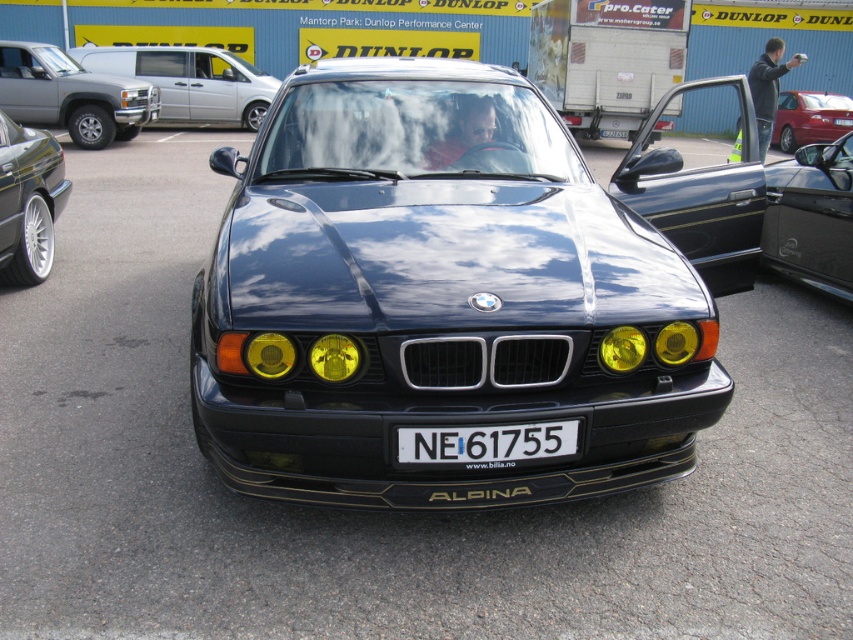
You are standing in front of a classic BMW Alpina car. There are two points marked on the car, one at coordinate point (x=13, y=234) and another at point (x=323, y=342). From your perspective, which point is closer to you?

Point (x=323, y=342) is closer to you because point (x=13, y=234) is behind it.